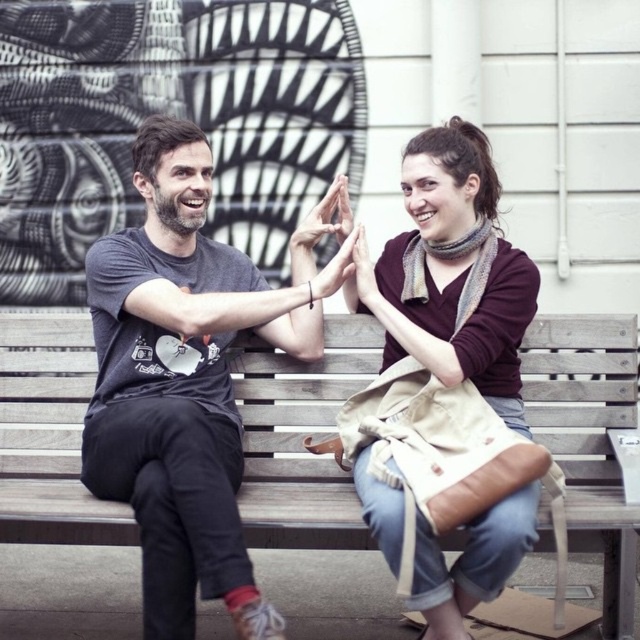
Which is more to the right, wooden bench at center or maroon sweater at center?

maroon sweater at center

At what (x,y) coordinates should I click in order to perform the action: click on wooden bench at center. Please return your answer as a coordinate pair (x, y). This screenshot has width=640, height=640. Looking at the image, I should click on (301, 438).

Is point (35, 436) positioned after point (476, 246)?

Yes, point (35, 436) is farther from viewer.

The image size is (640, 640). I want to click on wooden bench at center, so click(x=301, y=438).

Is gray matte t-shirt at center wider than maroon sweater at center?

Yes.

Can you confirm if gray matte t-shirt at center is taller than maroon sweater at center?

Yes.

What do you see at coordinates (188, 378) in the screenshot? This screenshot has height=640, width=640. I see `gray matte t-shirt at center` at bounding box center [188, 378].

This screenshot has height=640, width=640. Identify the location of gray matte t-shirt at center. (188, 378).

Where is `gray matte t-shirt at center`? Image resolution: width=640 pixels, height=640 pixels. gray matte t-shirt at center is located at coordinates (188, 378).

Between gray matte t-shirt at center and wooden bench at center, which one has more height?

Standing taller between the two is gray matte t-shirt at center.

This screenshot has height=640, width=640. I want to click on gray matte t-shirt at center, so click(188, 378).